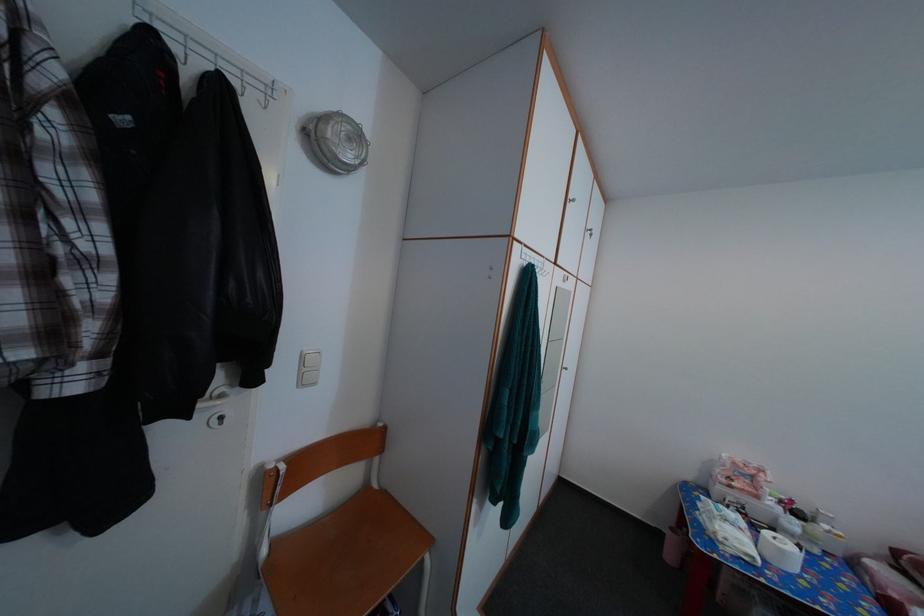
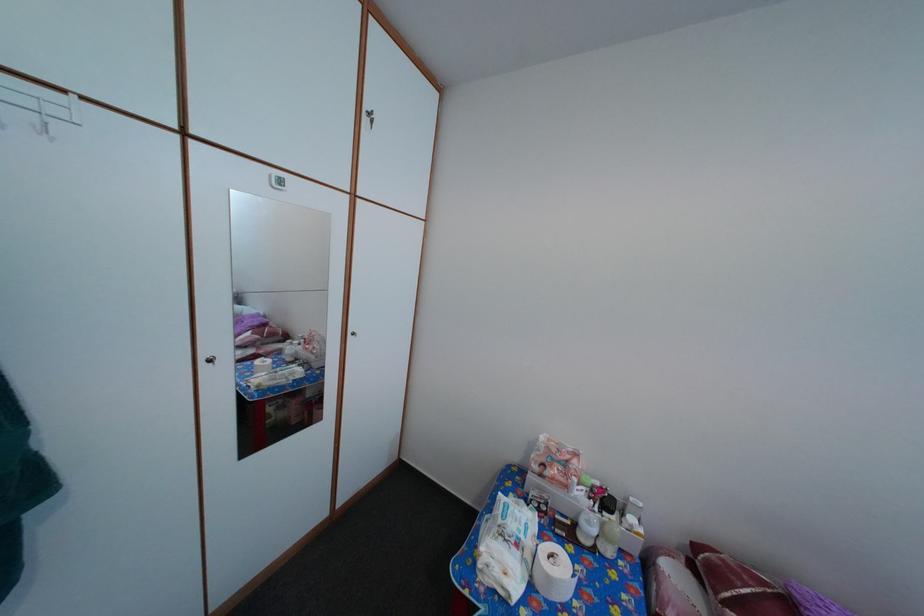
In the second image, find the point that corresponds to point 762,484 in the first image.

(576, 469)